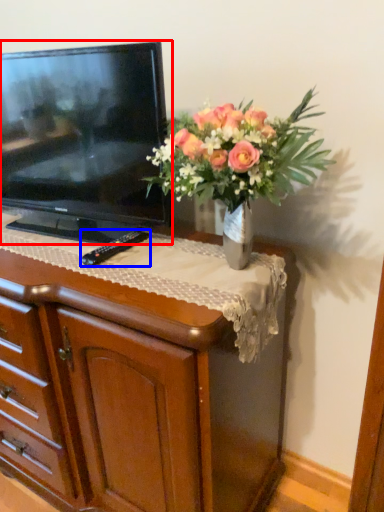
Question: Among these objects, which one is nearest to the camera, television (highlighted by a red box) or remote (highlighted by a blue box)?

Choices:
 (A) television
 (B) remote

Answer: (A)